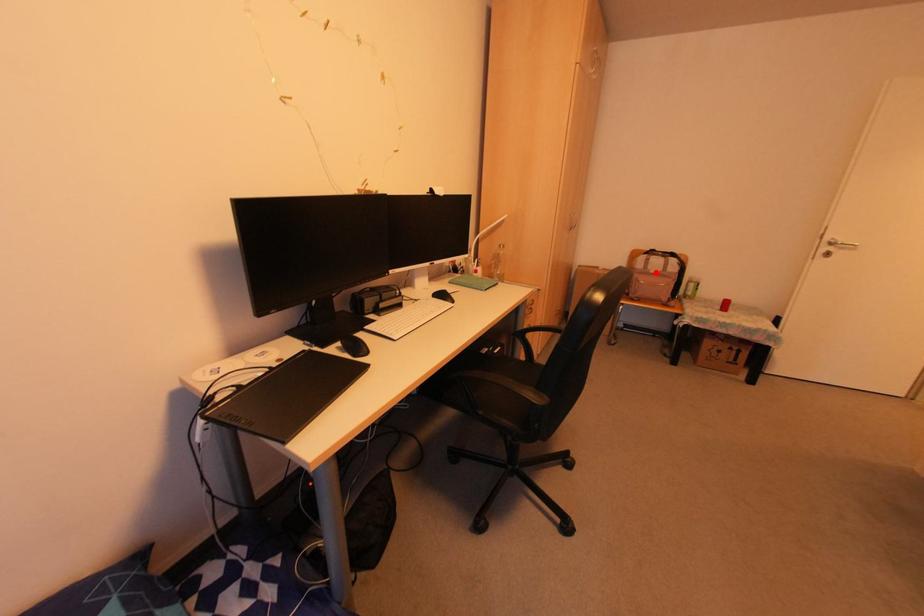
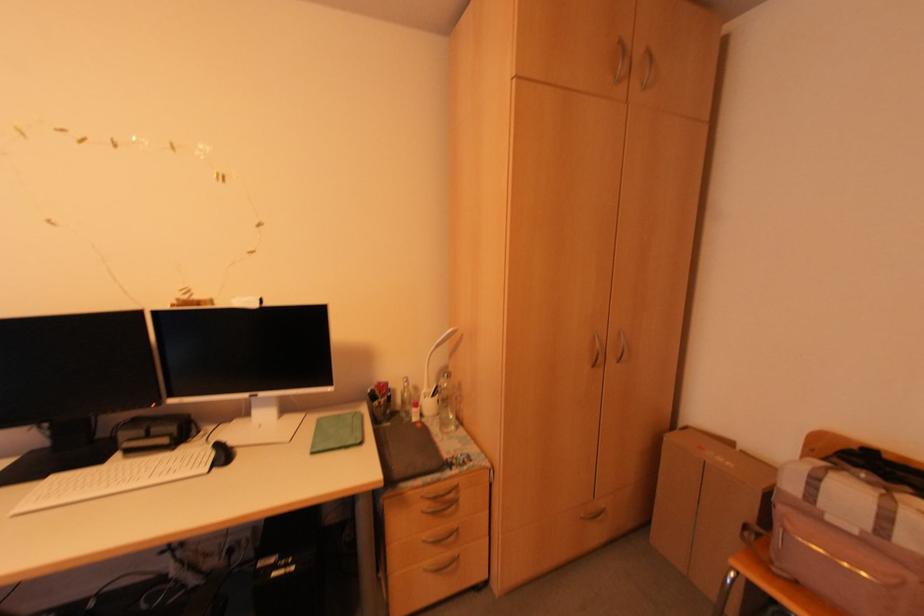
Locate, in the second image, the point that corresponds to the highlighted location in the first image.

(854, 532)